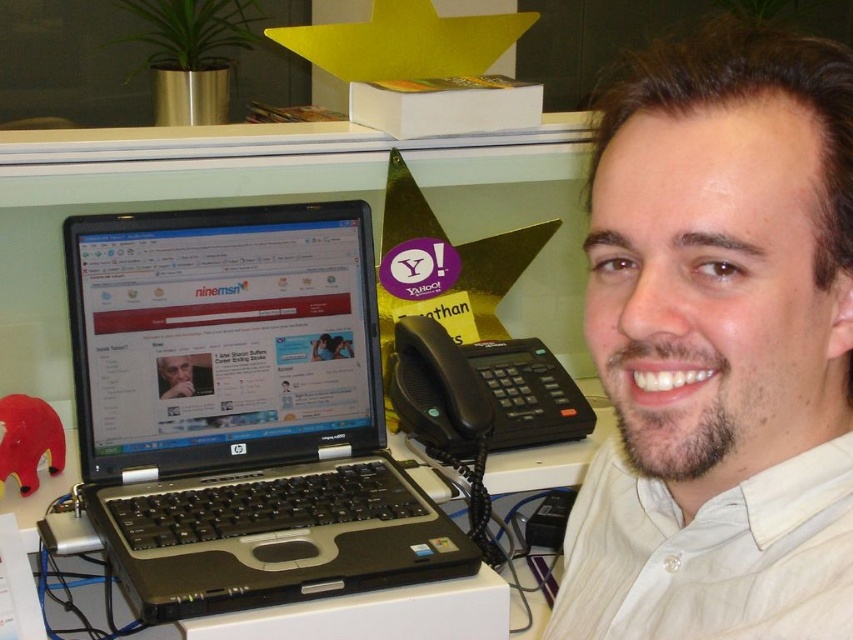
You are a delivery person who needs to place a package on the desk. The package is 10 cm tall. The desk has the white shirt at center and black plastic telephone at center. Can the package be placed on the desk without covering either object?

The white shirt at center is positioned over the black plastic telephone at center, so placing the package might cover both objects. However, since the package is only 10 cm tall, it can be placed on the desk in an area not occupied by either object, ensuring it doesn not cover them.

You are standing in front of the desk and want to place a small plant exactly at point (310, 225) on the desk. If your hand can reach up to 1 meter, will you be able to reach that point?

The distance of point (310, 225) from the camera is 1.14 meters, so your hand can only reach up to 1 meter. Therefore, you won

You are a delivery person who needs to place a small package on the desk between the black plastic laptop at left and the black plastic telephone at center. The package is 20 centimeters long. Will it fit in the space between them?

The space between the black plastic laptop at left and the black plastic telephone at center is 22.77 centimeters. Since the package is 20 centimeters long, it will fit as there is enough space.